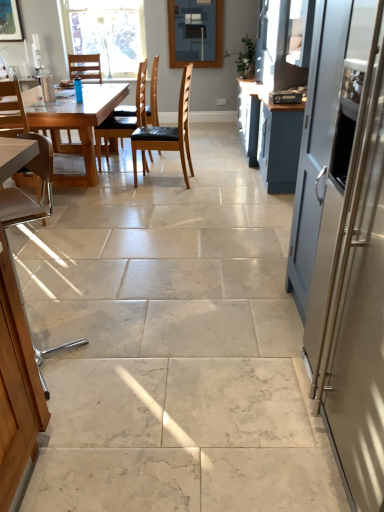
Question: Do you think satin silver refrigerator at right is within light brown wooden table at left, or outside of it?

Choices:
 (A) outside
 (B) inside

Answer: (A)

Question: In the image, is satin silver refrigerator at right positioned in front of or behind light brown wooden table at left?

Choices:
 (A) front
 (B) behind

Answer: (A)

Question: Considering the real-world distances, which object is farthest from the clear glass window at upper center?

Choices:
 (A) satin silver refrigerator at right
 (B) light brown leather chair at left, the first chair viewed from the front
 (C) matte glass window screen at upper center
 (D) black leather chair at upper left, which is the 3th chair in front-to-back order
 (E) light brown wooden table at left

Answer: (A)

Question: Which object is the farthest from the satin silver refrigerator at right?

Choices:
 (A) matte glass window screen at upper center
 (B) black leather chair at upper left, the second chair in the back-to-front sequence
 (C) brown leather chair at center, arranged as the 2th chair when viewed from the front
 (D) light brown wooden table at left
 (E) blue plastic chair at upper left, the 1th chair from the back

Answer: (E)